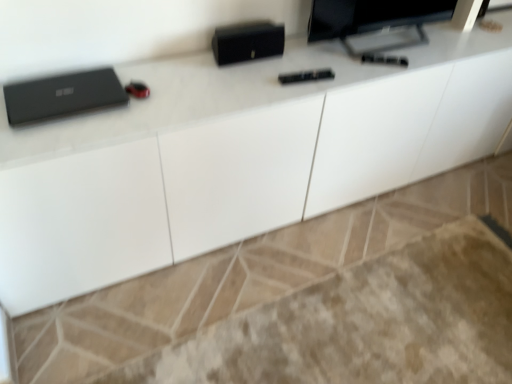
You are a GUI agent. You are given a task and a screenshot of the screen. Output one action in this format:
    pyautogui.click(x=<x>, y=<y>)
    Task: Click on the spots to the right of matte black laptop at left
    
    Given the screenshot: What is the action you would take?
    pyautogui.click(x=152, y=107)